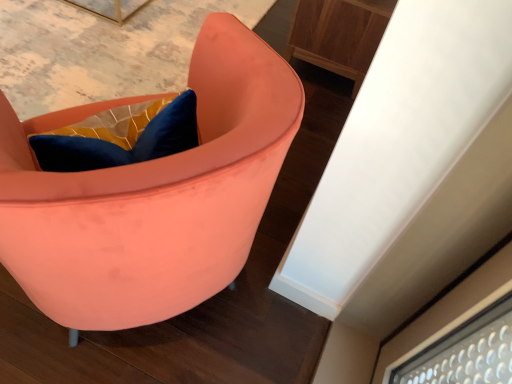
Measure the distance between point (268,182) and camera.

A distance of 36.81 inches exists between point (268,182) and camera.

The image size is (512, 384). What do you see at coordinates (152, 195) in the screenshot?
I see `matte coral chair at center` at bounding box center [152, 195].

The image size is (512, 384). I want to click on matte coral chair at center, so click(152, 195).

I want to click on wooden cabinet at upper right, so click(339, 35).

What is the approximate width of wooden cabinet at upper right?

It is 18.11 inches.

The width and height of the screenshot is (512, 384). What do you see at coordinates (339, 35) in the screenshot? I see `wooden cabinet at upper right` at bounding box center [339, 35].

This screenshot has height=384, width=512. What are the coordinates of `matte coral chair at center` in the screenshot? It's located at (152, 195).

Between matte coral chair at center and wooden cabinet at upper right, which one appears on the left side from the viewer's perspective?

From the viewer's perspective, matte coral chair at center appears more on the left side.

Which object is more forward, matte coral chair at center or wooden cabinet at upper right?

matte coral chair at center is in front.

Does point (276, 116) come behind point (305, 37)?

No, it is not.

From the image's perspective, is matte coral chair at center below wooden cabinet at upper right?

Yes, from the image's perspective, matte coral chair at center is below wooden cabinet at upper right.

From a real-world perspective, is matte coral chair at center below wooden cabinet at upper right?

No, from a real-world perspective, matte coral chair at center is not under wooden cabinet at upper right.

Looking at their sizes, would you say matte coral chair at center is wider or thinner than wooden cabinet at upper right?

In the image, matte coral chair at center appears to be wider than wooden cabinet at upper right.

Who is shorter, matte coral chair at center or wooden cabinet at upper right?

wooden cabinet at upper right.

Can you confirm if matte coral chair at center is bigger than wooden cabinet at upper right?

Yes, matte coral chair at center is bigger than wooden cabinet at upper right.

Is matte coral chair at center completely or partially outside of wooden cabinet at upper right?

That's correct, matte coral chair at center is outside of wooden cabinet at upper right.

Is matte coral chair at center positioned far away from wooden cabinet at upper right?

matte coral chair at center is far away from wooden cabinet at upper right.

Is matte coral chair at center facing towards wooden cabinet at upper right?

No, matte coral chair at center is not facing towards wooden cabinet at upper right.

Consider the image. How many degrees apart are the facing directions of matte coral chair at center and wooden cabinet at upper right?

The facing directions of matte coral chair at center and wooden cabinet at upper right are 43 degrees apart.

At what (x,y) coordinates should I click in order to perform the action: click on chair above the wooden cabinet at upper right (from a real-world perspective). Please return your answer as a coordinate pair (x, y). The height and width of the screenshot is (384, 512). Looking at the image, I should click on (152, 195).

Between wooden cabinet at upper right and matte coral chair at center, which one appears on the right side from the viewer's perspective?

From the viewer's perspective, wooden cabinet at upper right appears more on the right side.

Which object is closer to the camera, wooden cabinet at upper right or matte coral chair at center?

matte coral chair at center is in front.

Is point (309, 43) farther from viewer compared to point (135, 210)?

Yes, it is behind point (135, 210).

From the image's perspective, is wooden cabinet at upper right over matte coral chair at center?

Yes, from the image's perspective, wooden cabinet at upper right is on top of matte coral chair at center.

In the scene shown: From a real-world perspective, is wooden cabinet at upper right under matte coral chair at center?

Yes, from a real-world perspective, wooden cabinet at upper right is under matte coral chair at center.

Is wooden cabinet at upper right thinner than matte coral chair at center?

Yes.

Is wooden cabinet at upper right shorter than matte coral chair at center?

Correct, wooden cabinet at upper right is not as tall as matte coral chair at center.

Between wooden cabinet at upper right and matte coral chair at center, which one has smaller size?

Smaller between the two is wooden cabinet at upper right.

Can matte coral chair at center be found inside wooden cabinet at upper right?

No, matte coral chair at center is not a part of wooden cabinet at upper right.

Is wooden cabinet at upper right in contact with matte coral chair at center?

No, wooden cabinet at upper right is not beside matte coral chair at center.

Is wooden cabinet at upper right facing away from matte coral chair at center?

wooden cabinet at upper right is not turned away from matte coral chair at center.

Can you tell me how much wooden cabinet at upper right and matte coral chair at center differ in facing direction?

The angular difference between wooden cabinet at upper right and matte coral chair at center is 43 degrees.

How much distance is there between wooden cabinet at upper right and matte coral chair at center?

wooden cabinet at upper right is 3.73 feet away from matte coral chair at center.

Locate an element on the screen. The image size is (512, 384). chair that appears in front of the wooden cabinet at upper right is located at coordinates (152, 195).

Locate an element on the screen. furniture beneath the matte coral chair at center (from a real-world perspective) is located at coordinates (339, 35).

The image size is (512, 384). Identify the location of chair above the wooden cabinet at upper right (from a real-world perspective). (152, 195).